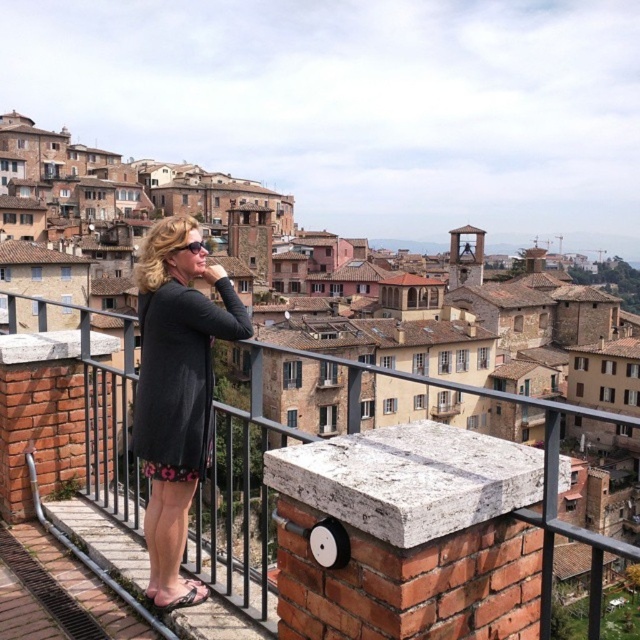
You are standing at the stone ledge and want to determine which of the two points, point (122, 468) or point (198, 394), is closer to you. Based on the coordinates provided, which point is nearer?

Point (122, 468) is closer to you because it is further to the viewer than point (198, 394) according to the description.

You are a fashion designer observing two dresses displayed at a fashion show. The dark gray dress at center and the floral print fabric dress at center are both on display. Which dress has a wider silhouette?

The floral print fabric dress at center has a wider silhouette than the dark gray dress at center.